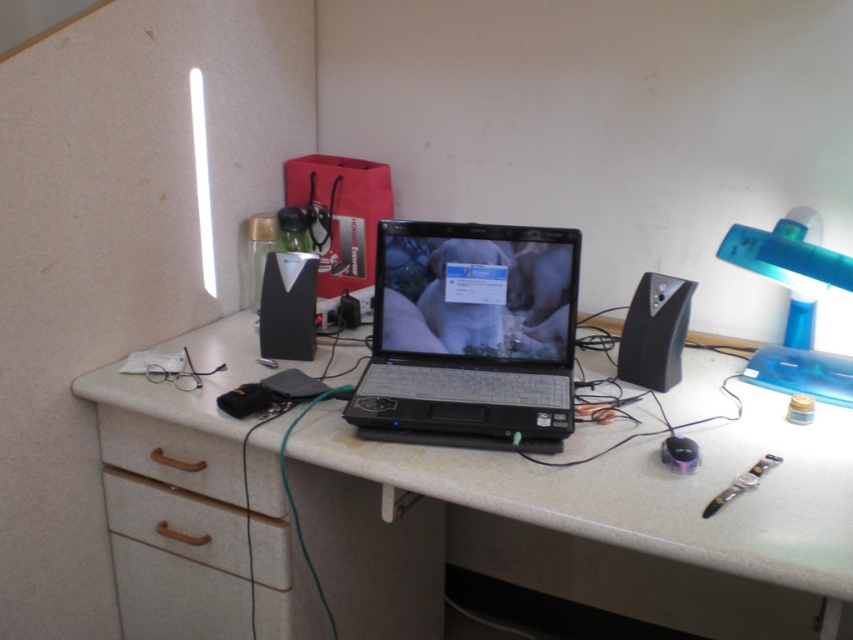
In the scene shown: You are organizing your workspace and want to move a small plant from the wooden drawer at lower left to the white laminate table at center. Based on their positions, will the plant be more visible from the front of the desk?

The white laminate table at center is in front of the wooden drawer at lower left, so placing the plant there will make it more visible from the front of the desk.

You are organizing the desk and need to place a new item between the black plastic laptop at center and the blue translucent lamp at right. Considering their sizes, which object should you place closer to the edge to ensure there is enough space?

The black plastic laptop at center is bigger than the blue translucent lamp at right, so you should place the blue translucent lamp at right closer to the edge to accommodate the larger laptop.

Based on the photo, you are organizing your desk and want to place a new 12 inch wide notebook between the black plastic laptop at center and the brown wood drawer at lower left. Is there enough space for it?

The black plastic laptop at center and brown wood drawer at lower left are 15.34 inches apart, so yes, there is enough space to place a 12 inch wide notebook between them since 15.34 inches is greater than 12 inches.